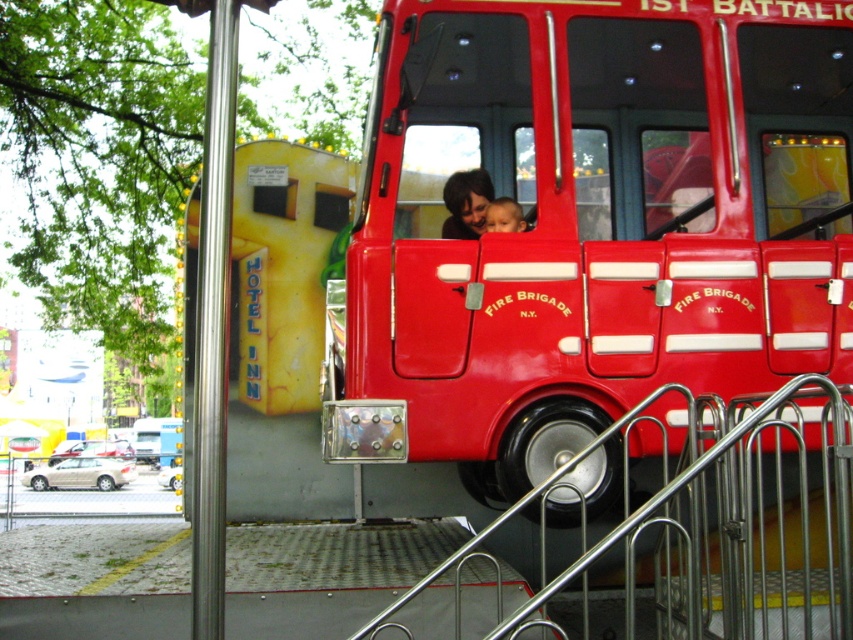
Question: From the image, what is the correct spatial relationship of shiny red fire truck at center in relation to smooth skin face at center?

Choices:
 (A) left
 (B) right

Answer: (B)

Question: Does shiny red fire truck at center have a lesser width compared to metallic silver rail at lower right?

Choices:
 (A) yes
 (B) no

Answer: (B)

Question: Which of the following is the closest to the observer?

Choices:
 (A) (709, 486)
 (B) (505, 204)
 (C) (763, 45)

Answer: (B)

Question: Is shiny red fire truck at center positioned in front of smooth skin face at center?

Choices:
 (A) yes
 (B) no

Answer: (A)

Question: Which point is farther to the camera?

Choices:
 (A) shiny red fire truck at center
 (B) smooth skin face at center
 (C) metallic silver rail at lower right

Answer: (B)

Question: Which object is farther from the camera taking this photo?

Choices:
 (A) metallic silver rail at lower right
 (B) smooth skin face at center
 (C) shiny red fire truck at center

Answer: (B)